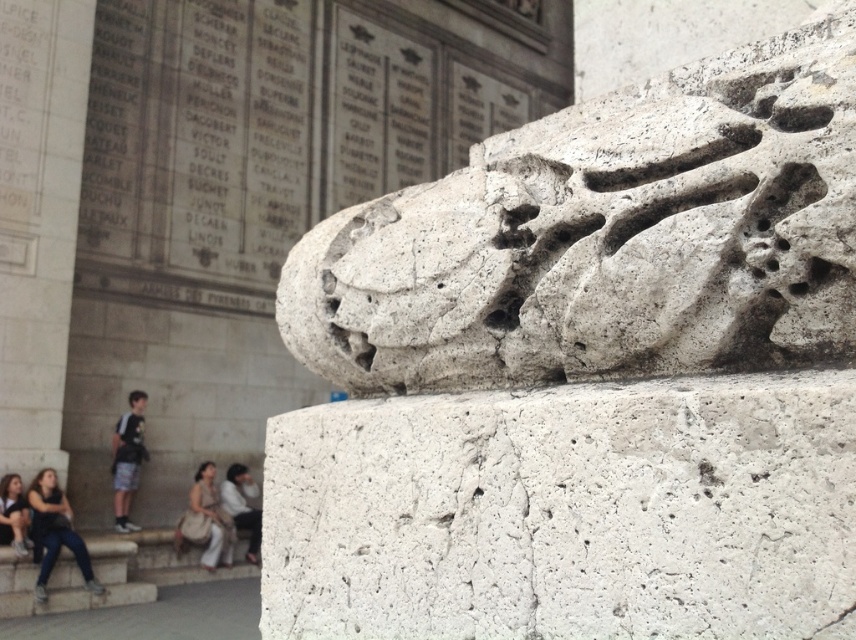
Which is in front, point (189, 529) or point (218, 488)?

Point (189, 529) is in front.

Which is behind, point (207, 538) or point (230, 508)?

Positioned behind is point (230, 508).

The width and height of the screenshot is (856, 640). I want to click on light brown fabric bag at lower center, so click(x=205, y=522).

Is point (218, 500) more distant than point (9, 474)?

Yes, it is.

Is light brown fabric bag at lower center to the left of light beige pants at lower left from the viewer's perspective?

In fact, light brown fabric bag at lower center is to the right of light beige pants at lower left.

At what (x,y) coordinates should I click in order to perform the action: click on light brown fabric bag at lower center. Please return your answer as a coordinate pair (x, y). The width and height of the screenshot is (856, 640). Looking at the image, I should click on (205, 522).

Based on the photo, is white stone lion at upper center positioned at the back of light beige fabric pants at lower center?

No, it is in front of light beige fabric pants at lower center.

Is point (765, 321) behind point (247, 468)?

No, (765, 321) is closer to viewer.

Does point (449, 320) come in front of point (244, 524)?

Yes, point (449, 320) is closer to viewer.

Identify the location of white stone lion at upper center. (607, 237).